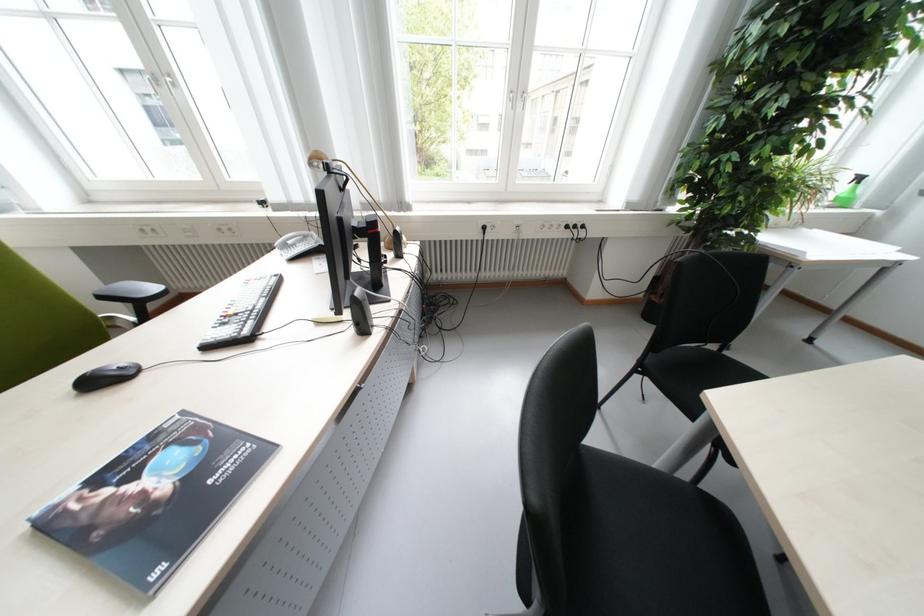
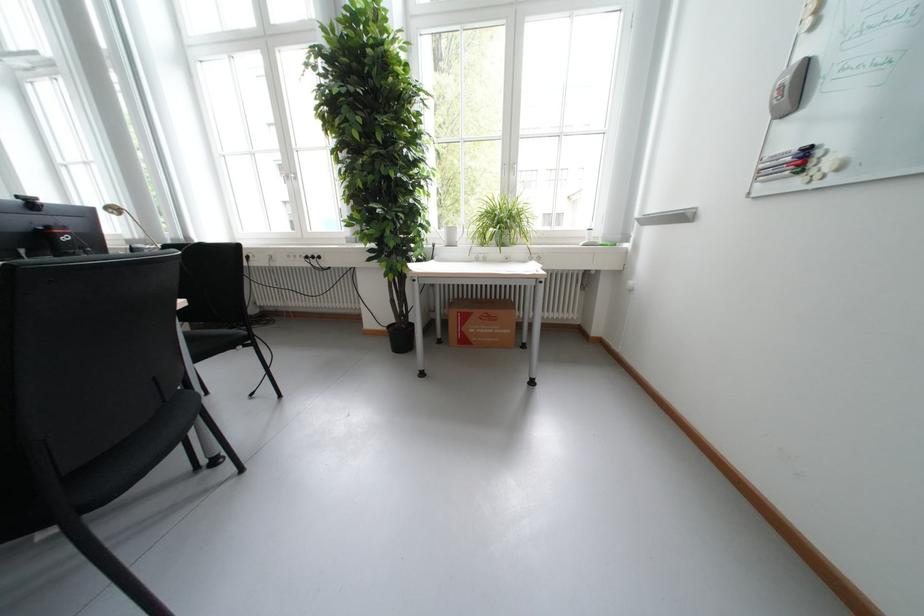
The point at (585,228) is marked in the first image. Where is the corresponding point in the second image?

(322, 257)